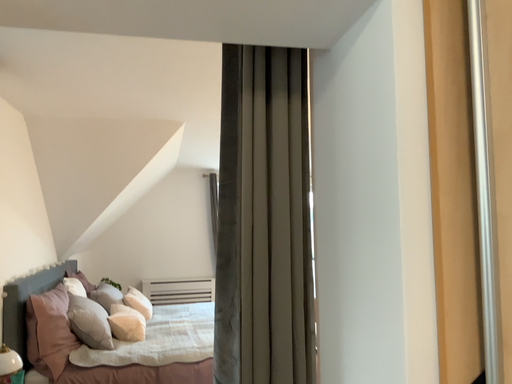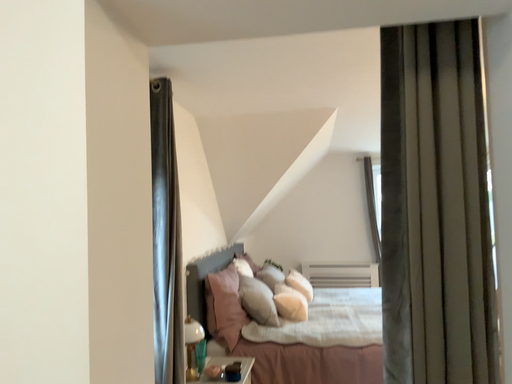
Question: Which way did the camera rotate in the video?

Choices:
 (A) rotated right
 (B) rotated left

Answer: (B)